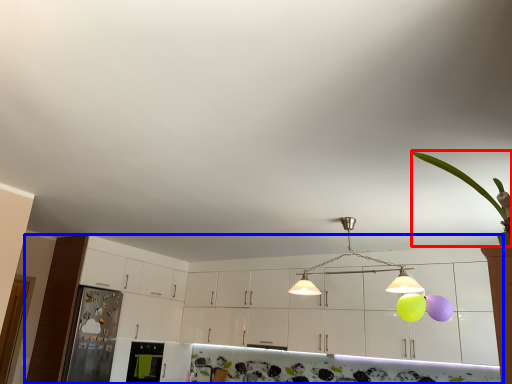
Question: Among these objects, which one is farthest to the camera, plant (highlighted by a red box) or cabinetry (highlighted by a blue box)?

Choices:
 (A) plant
 (B) cabinetry

Answer: (B)